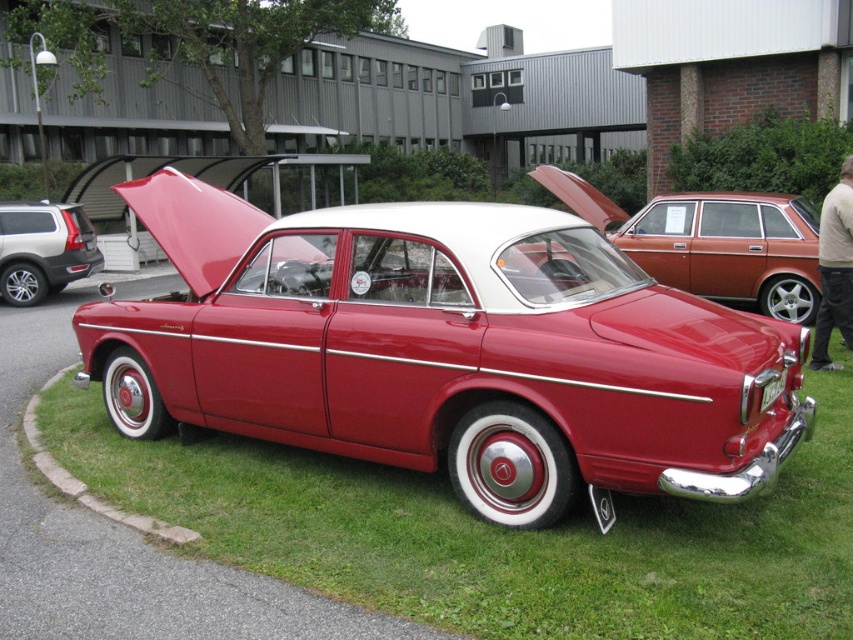
Question: Is green grass at lower center bigger than matte silver suv at left?

Choices:
 (A) yes
 (B) no

Answer: (B)

Question: Based on their relative distances, which object is nearer to the shiny red car at center?

Choices:
 (A) matte silver suv at left
 (B) green grass at lower center
 (C) glossy red car at center

Answer: (C)

Question: Which object is positioned farthest from the matte silver suv at left?

Choices:
 (A) glossy red car at center
 (B) green grass at lower center

Answer: (A)

Question: Among these objects, which one is farthest from the camera?

Choices:
 (A) matte silver suv at left
 (B) shiny red car at center

Answer: (A)

Question: Is glossy red car at center thinner than shiny red car at center?

Choices:
 (A) no
 (B) yes

Answer: (A)

Question: Is glossy red car at center to the left of green grass at lower center from the viewer's perspective?

Choices:
 (A) no
 (B) yes

Answer: (A)